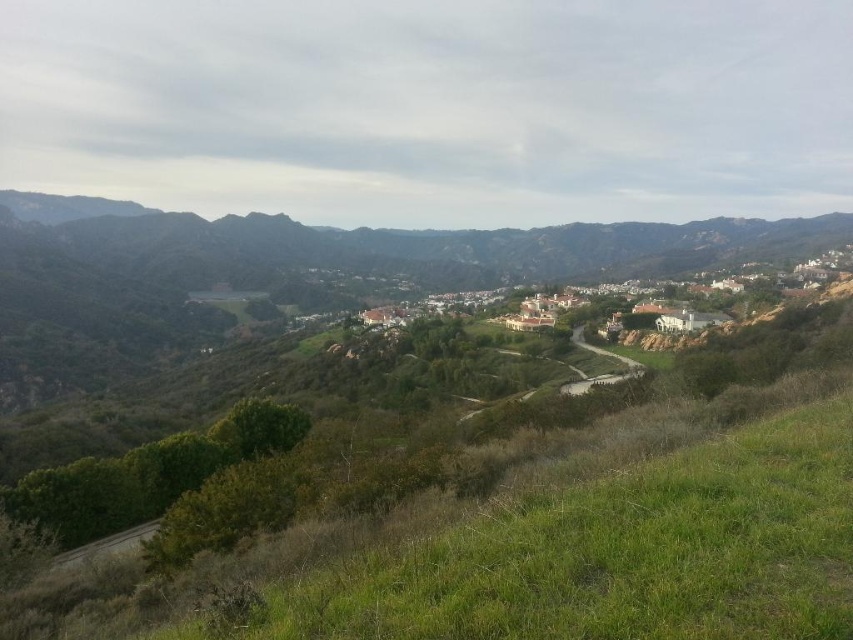
Based on the photo, can you confirm if green grassy hillside at center is positioned to the left of white stucco houses at center?

Indeed, green grassy hillside at center is positioned on the left side of white stucco houses at center.

Does green grassy hillside at center have a lesser width compared to white stucco houses at center?

No.

Image resolution: width=853 pixels, height=640 pixels. Describe the element at coordinates (405, 243) in the screenshot. I see `green grassy hillside at center` at that location.

Where is `green grassy hillside at center`? The width and height of the screenshot is (853, 640). green grassy hillside at center is located at coordinates click(405, 243).